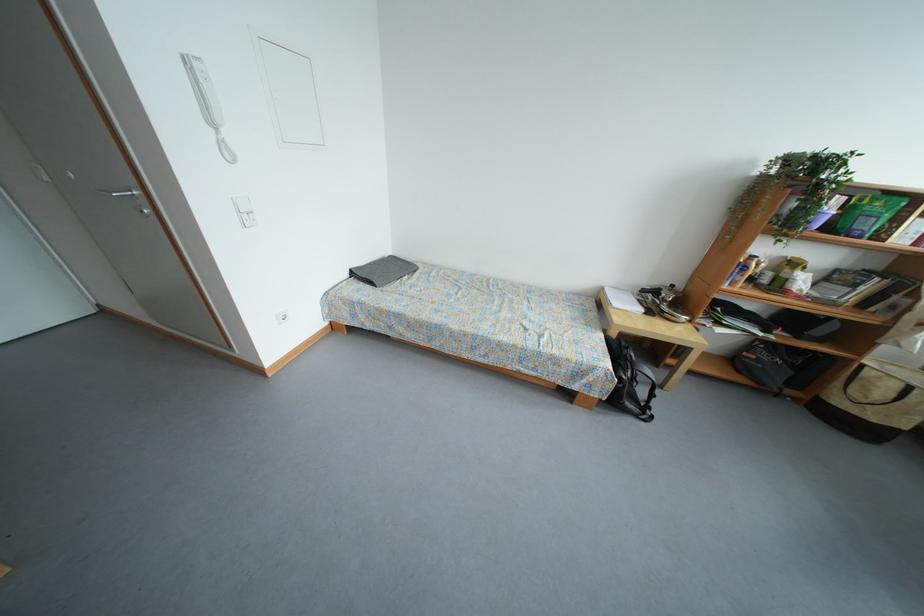
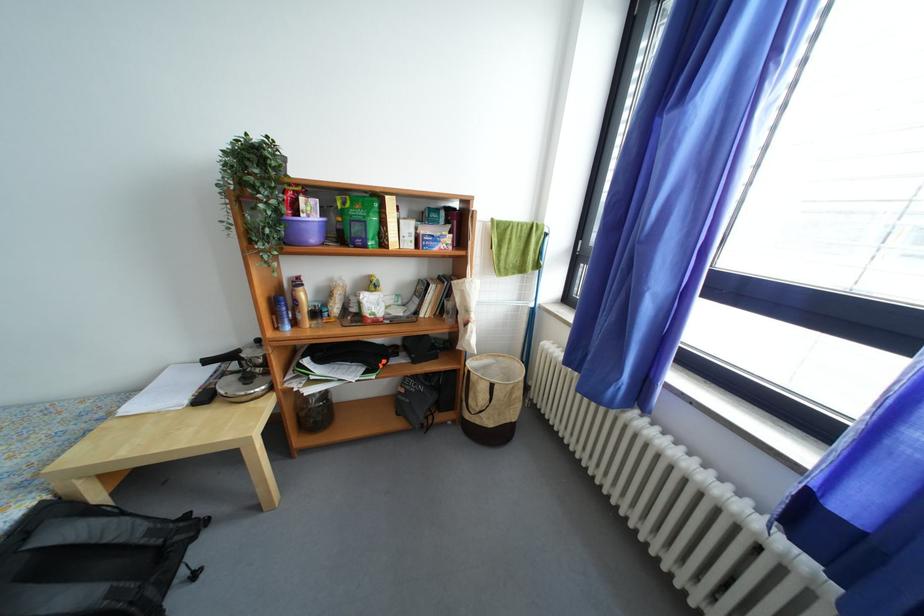
The point at (822, 231) is marked in the first image. Where is the corresponding point in the second image?

(320, 243)